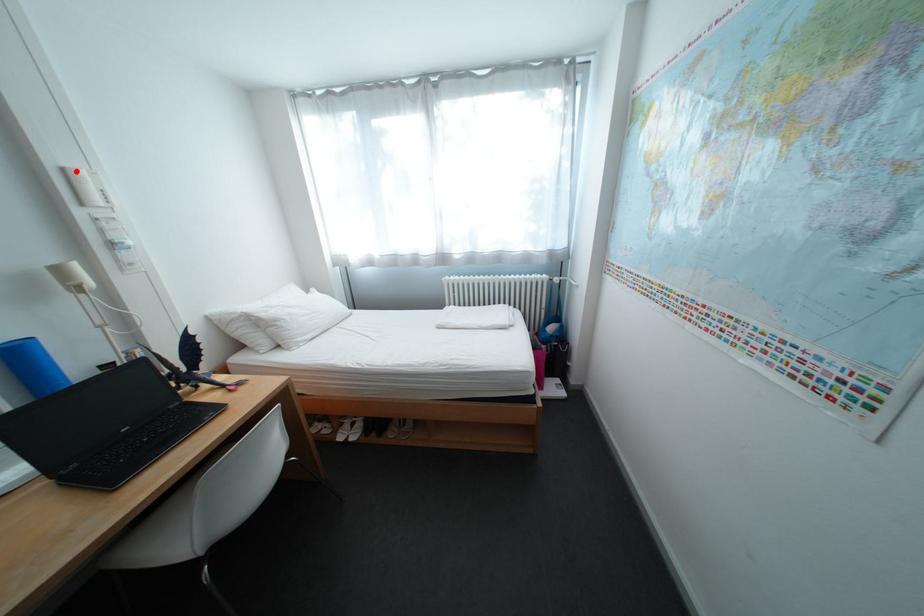
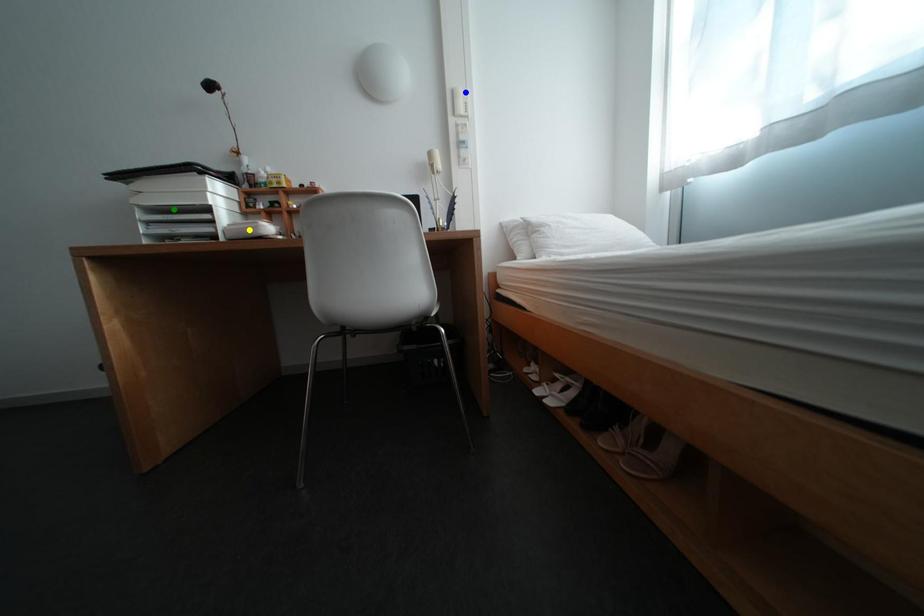
Question: I am providing you with two images of the same scene from different viewpoints. A red point is marked on the first image. You are given multiple points on the second image. Which mark in image 2 goes with the point in image 1?

Choices:
 (A) green point
 (B) yellow point
 (C) blue point

Answer: (C)